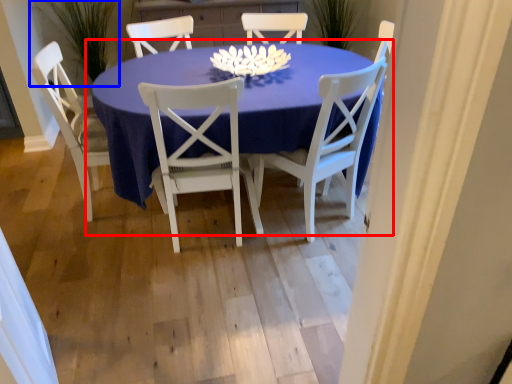
Question: Which object appears farthest to the camera in this image, kitchen & dining room table (highlighted by a red box) or plant (highlighted by a blue box)?

Choices:
 (A) kitchen & dining room table
 (B) plant

Answer: (B)